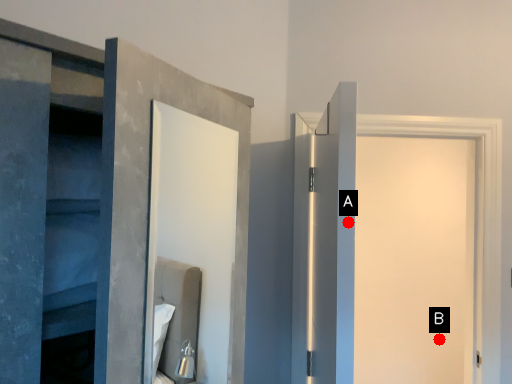
Question: Two points are circled on the image, labeled by A and B beside each circle. Among these points, which one is nearest to the camera?

Choices:
 (A) A is closer
 (B) B is closer

Answer: (A)